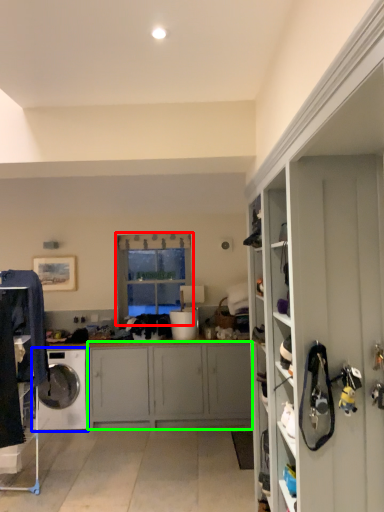
Question: Which object is the closest to the window (highlighted by a red box)? Choose among these: washing machine (highlighted by a blue box) or cabinetry (highlighted by a green box).

Choices:
 (A) washing machine
 (B) cabinetry

Answer: (B)